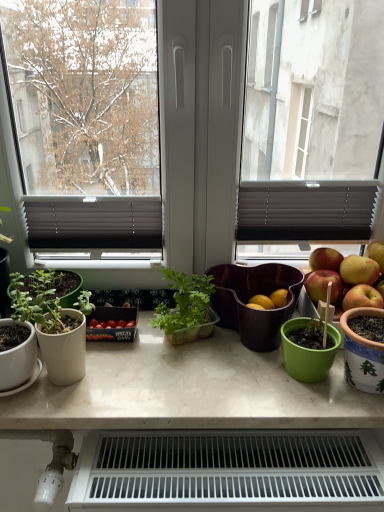
Question: Is white plastic radiator at lower center looking in the opposite direction of translucent plastic plant container at center, the first houseplant when ordered from right to left?

Choices:
 (A) yes
 (B) no

Answer: (B)

Question: Is white plastic radiator at lower center beside translucent plastic plant container at center, which is the 2th houseplant in left-to-right order?

Choices:
 (A) yes
 (B) no

Answer: (B)

Question: From a real-world perspective, is white plastic radiator at lower center on top of translucent plastic plant container at center, which is the 2th houseplant in left-to-right order?

Choices:
 (A) no
 (B) yes

Answer: (A)

Question: Does white plastic radiator at lower center have a lesser height compared to translucent plastic plant container at center, which is the 2th houseplant in left-to-right order?

Choices:
 (A) yes
 (B) no

Answer: (B)

Question: Considering the relative positions of white plastic radiator at lower center and translucent plastic plant container at center, which is the 2th houseplant in left-to-right order, in the image provided, is white plastic radiator at lower center to the right of translucent plastic plant container at center, which is the 2th houseplant in left-to-right order, from the viewer's perspective?

Choices:
 (A) yes
 (B) no

Answer: (A)

Question: Is white marble table at center inside or outside of white plastic radiator at lower center?

Choices:
 (A) outside
 (B) inside

Answer: (A)

Question: Considering the positions of point (56, 421) and point (362, 493), is point (56, 421) closer or farther from the camera than point (362, 493)?

Choices:
 (A) closer
 (B) farther

Answer: (B)

Question: From the image's perspective, is white marble table at center above or below white plastic radiator at lower center?

Choices:
 (A) below
 (B) above

Answer: (B)

Question: In terms of size, does white marble table at center appear bigger or smaller than white plastic radiator at lower center?

Choices:
 (A) big
 (B) small

Answer: (B)

Question: Is christmas-patterned ceramic pot at right inside the boundaries of white marble table at center, or outside?

Choices:
 (A) outside
 (B) inside

Answer: (A)

Question: From their relative heights in the image, would you say christmas-patterned ceramic pot at right is taller or shorter than white marble table at center?

Choices:
 (A) tall
 (B) short

Answer: (A)

Question: From the image's perspective, relative to white marble table at center, is christmas-patterned ceramic pot at right above or below?

Choices:
 (A) above
 (B) below

Answer: (A)

Question: In the image, is christmas-patterned ceramic pot at right positioned in front of or behind white marble table at center?

Choices:
 (A) front
 (B) behind

Answer: (A)

Question: Is point (198, 300) positioned closer to the camera than point (246, 287)?

Choices:
 (A) farther
 (B) closer

Answer: (B)

Question: From a real-world perspective, is translucent plastic plant container at center, which is the 2th houseplant in left-to-right order, above or below matte purple salad bowl at center?

Choices:
 (A) below
 (B) above

Answer: (B)